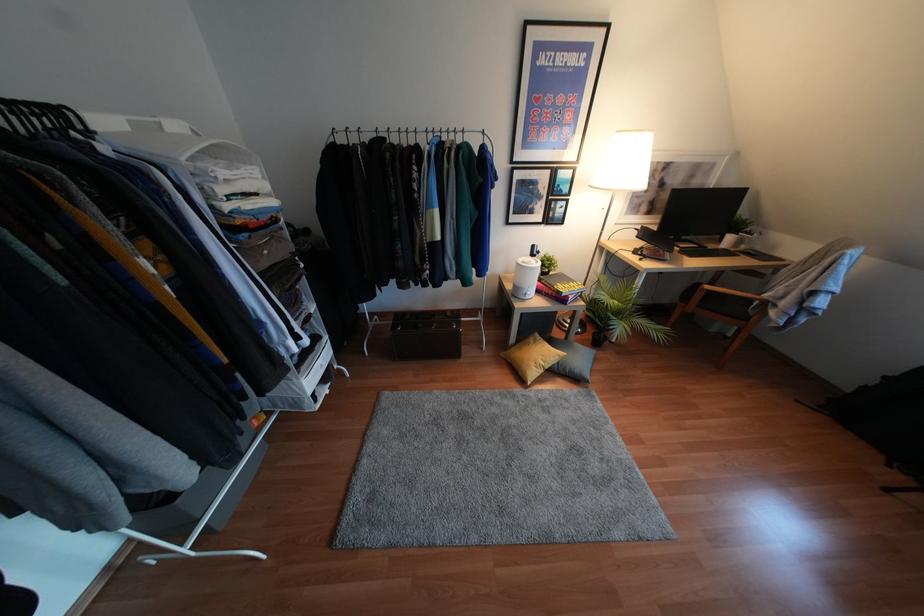
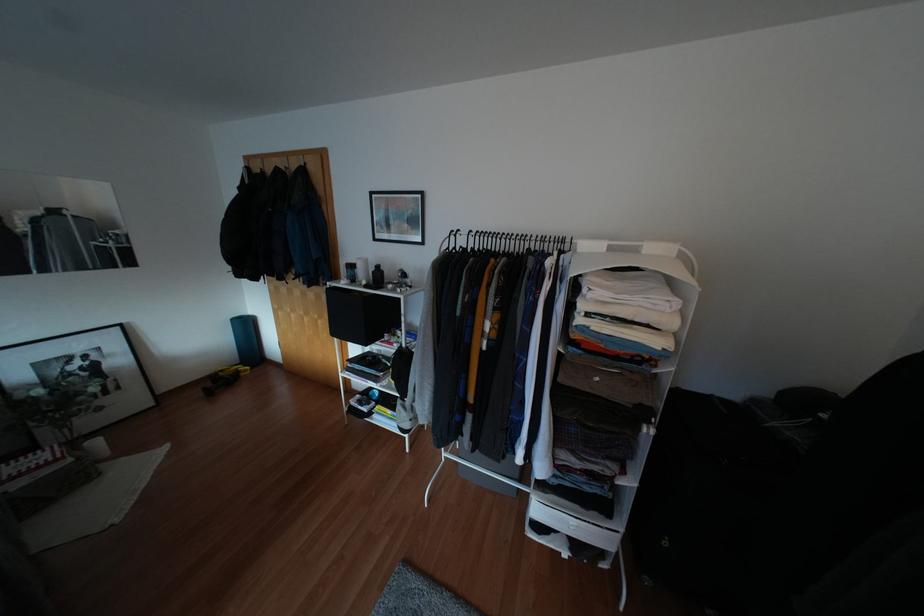
The images are taken continuously from a first-person perspective. In which direction is your viewpoint rotating?

The camera rotated toward left-down.